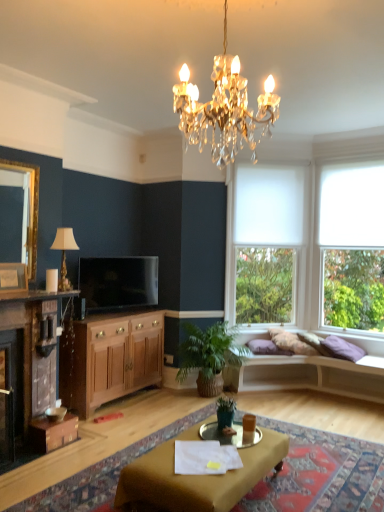
Question: Does point [x=372, y=266] appear closer or farther from the camera than point [x=119, y=392]?

Choices:
 (A) farther
 (B) closer

Answer: (A)

Question: Is transparent glass window at right, placed as the first window when sorted from right to left, to the left or to the right of wooden cabinet at lower left in the image?

Choices:
 (A) left
 (B) right

Answer: (B)

Question: Estimate the real-world distances between objects in this image. Which object is farther from the brown wood cabinet at left?

Choices:
 (A) matte black mantel at left
 (B) green woven basket at lower center, which ranks as the second houseplant in front-to-back order
 (C) matte gold picture frame at left
 (D) transparent glass window at right, which is the second window in left-to-right order
 (E) white fabric lampshade at left

Answer: (D)

Question: Which of these objects is positioned closest to the white wood studio couch at lower right?

Choices:
 (A) white fabric lampshade at left
 (B) clear glass tray at center
 (C) matte black mantel at left
 (D) transparent glass window at right, which is the second window in left-to-right order
 (E) matte brown desk at center

Answer: (D)